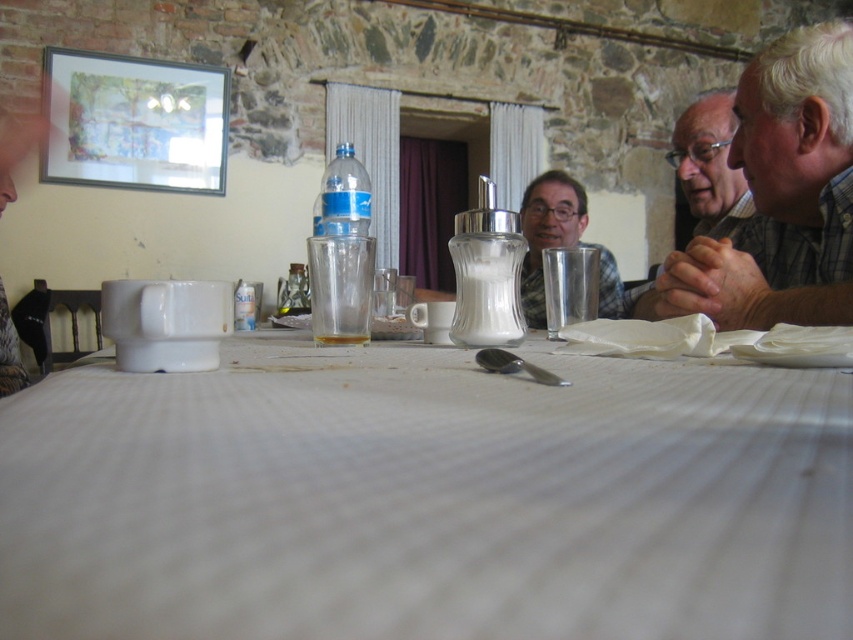
You are a server in the restaurant and need to place a large tray on the table. The tray is wider than the plaid shirt at right. Can you fit the tray on the white textured tablecloth at center?

The white textured tablecloth at center is wider than the plaid shirt at right, so the tray can fit on the white textured tablecloth at center since its width is sufficient.

You are a waiter who needs to deliver a drink to the customer wearing the plaid shirt at right. The drink you are holding is in the translucent glass at center. Can you place the drink directly in front of the customer without moving any other items on the table?

The plaid shirt at right and translucent glass at center are 23.08 inches apart. Since the distance between them is sufficient to place the drink directly in front of the customer, yes, you can do so without moving other items on the table.

You need to place a small decorative item on the table. Given the white textured tablecloth at center and the translucent glass at center, which object has enough space to accommodate the item without overlapping?

The white textured tablecloth at center has enough space because its width is larger than the translucent glass at center.